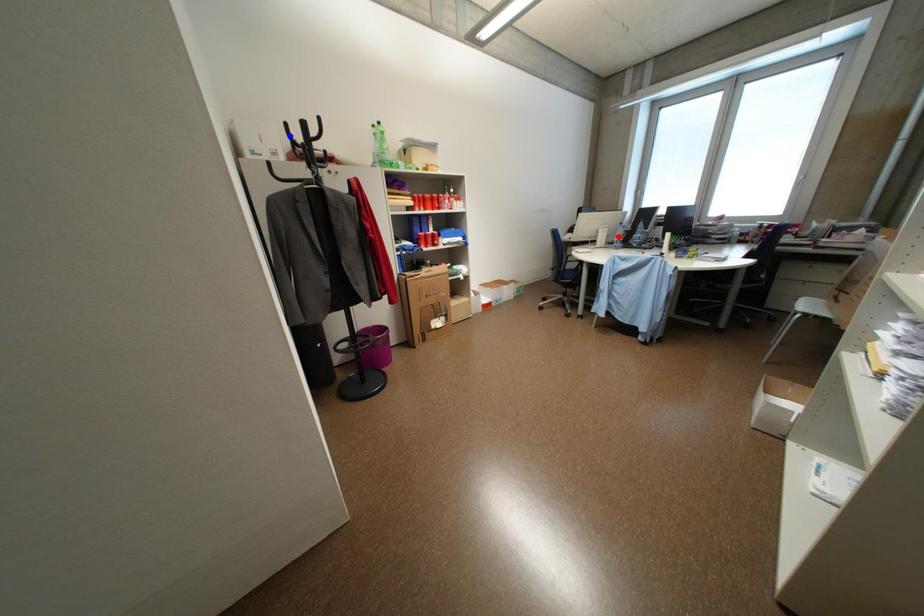
Question: Two points are marked on the image. Which point is closer to the camera?

Choices:
 (A) Blue point is closer.
 (B) Red point is closer.

Answer: (A)